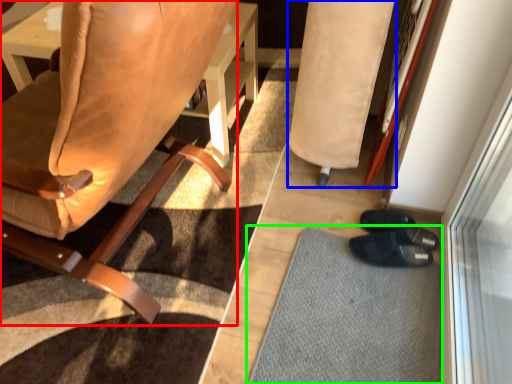
Question: Which object is the closest to the chair (highlighted by a red box)? Choose among these: bean bag chair (highlighted by a blue box) or doormat (highlighted by a green box).

Choices:
 (A) bean bag chair
 (B) doormat

Answer: (A)